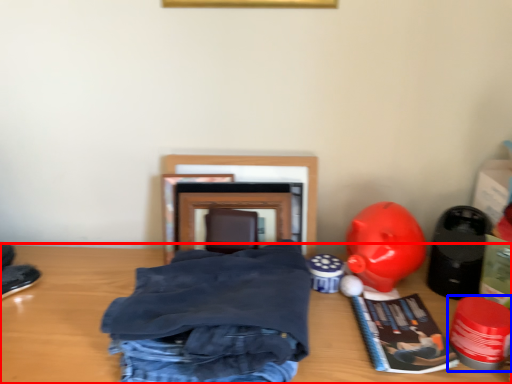
Question: Among these objects, which one is nearest to the camera, table (highlighted by a red box) or toy (highlighted by a blue box)?

Choices:
 (A) table
 (B) toy

Answer: (B)